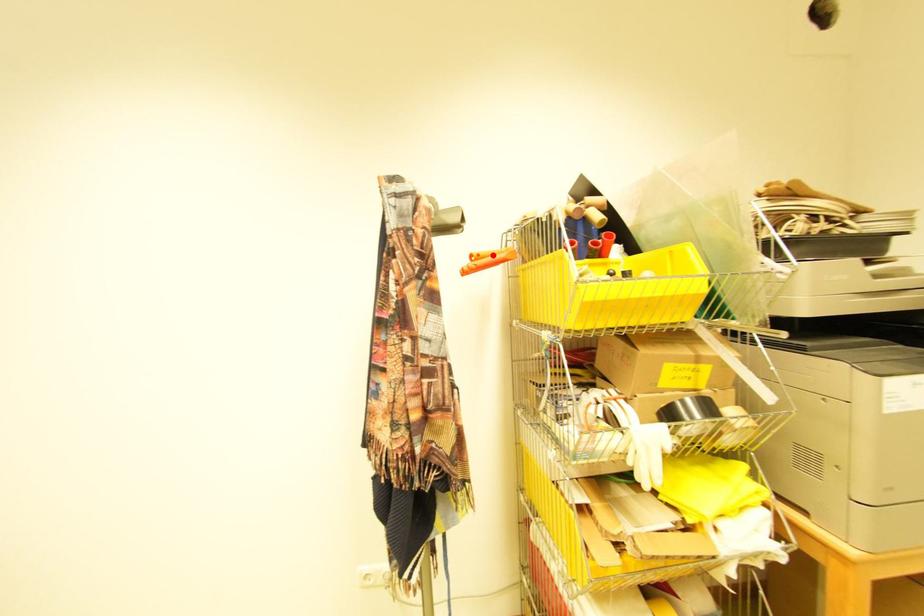
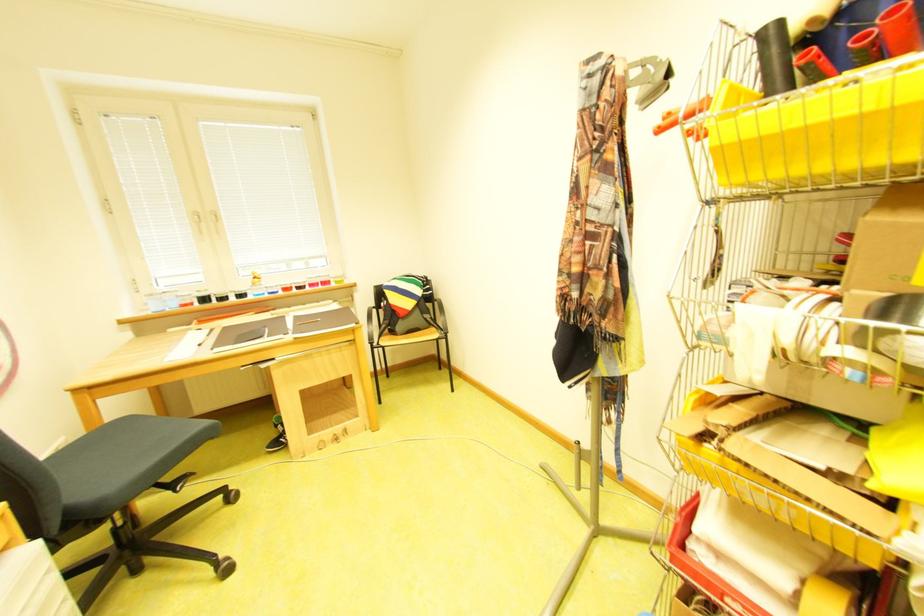
Find the pixel in the second image that matches the highlighted location in the first image.

(687, 111)